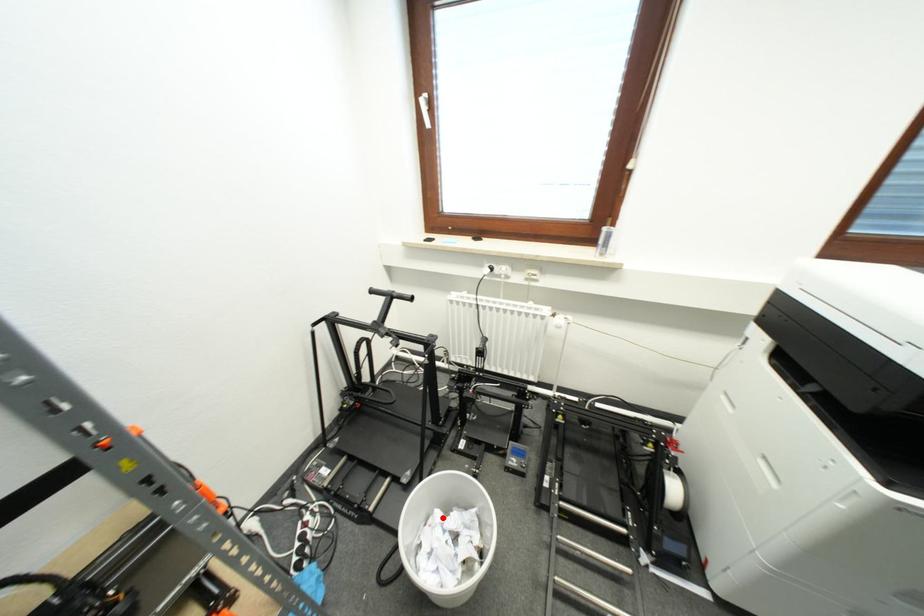
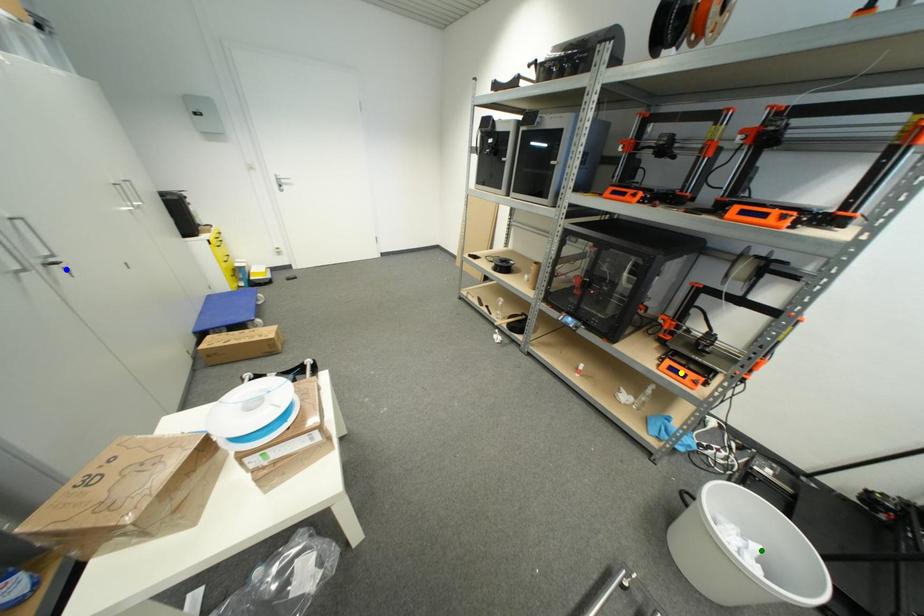
Question: I am providing you with two images of the same scene from different viewpoints. A red point is marked on the first image. You are given multiple points on the second image. Which mark in image 2 goes with the point in image 1?

Choices:
 (A) green point
 (B) blue point
 (C) yellow point

Answer: (A)